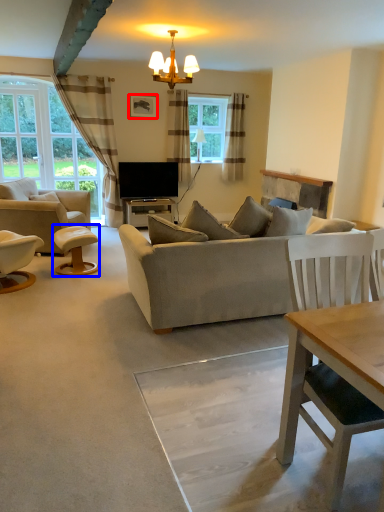
Question: Which object is further to the camera taking this photo, picture frame (highlighted by a red box) or stool (highlighted by a blue box)?

Choices:
 (A) picture frame
 (B) stool

Answer: (A)